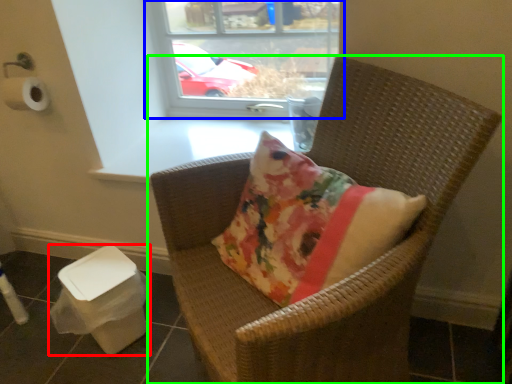
Question: Which is nearer to the potty (highlighted by a red box)? window (highlighted by a blue box) or chair (highlighted by a green box).

Choices:
 (A) window
 (B) chair

Answer: (B)